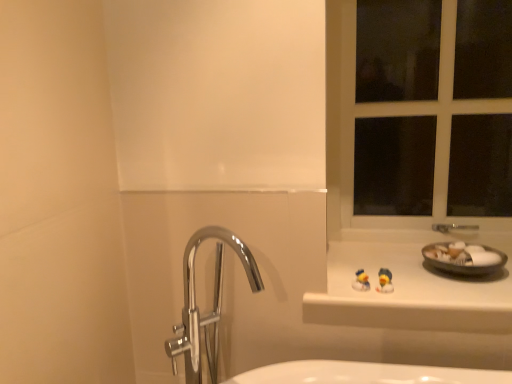
At what (x,y) coordinates should I click in order to perform the action: click on vacant space situated above matte gray bowl at right (from a real-world perspective). Please return your answer as a coordinate pair (x, y). Image resolution: width=512 pixels, height=384 pixels. Looking at the image, I should click on (467, 255).